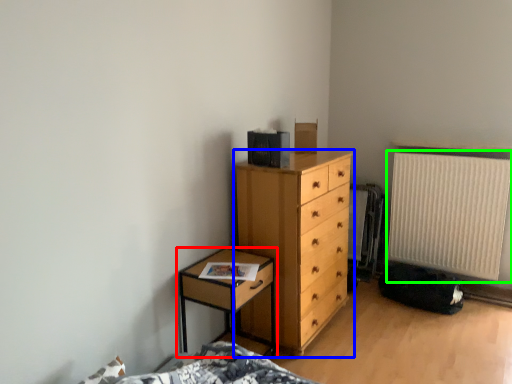
Question: Which object is the closest to the nightstand (highlighted by a red box)? Choose among these: chest of drawers (highlighted by a blue box) or radiator (highlighted by a green box).

Choices:
 (A) chest of drawers
 (B) radiator

Answer: (A)